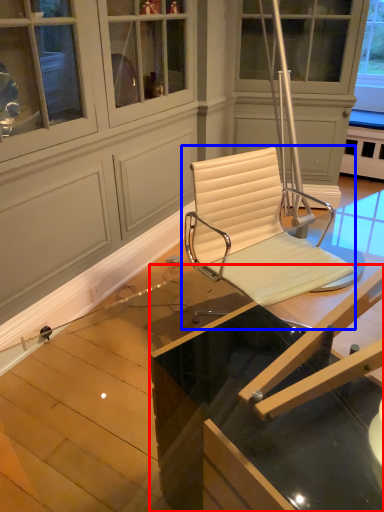
Question: Which of the following is the farthest to the observer, table (highlighted by a red box) or chair (highlighted by a blue box)?

Choices:
 (A) table
 (B) chair

Answer: (B)